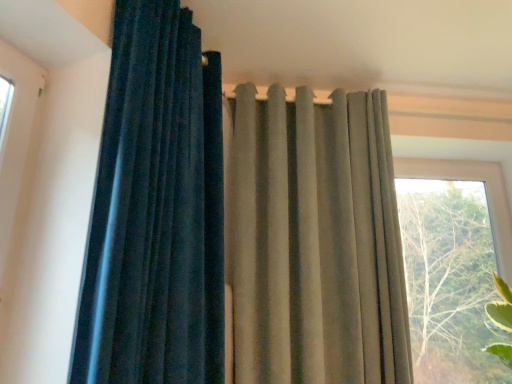
Question: Does velvet dark blue curtain at left, positioned as the second curtain in right-to-left order, appear on the left side of satin beige curtain at upper center, which is the second curtain from left to right?

Choices:
 (A) yes
 (B) no

Answer: (A)

Question: From a real-world perspective, is velvet dark blue curtain at left, acting as the first curtain starting from the left, physically below satin beige curtain at upper center, which is the second curtain from left to right?

Choices:
 (A) no
 (B) yes

Answer: (A)

Question: Is velvet dark blue curtain at left, positioned as the second curtain in right-to-left order, shorter than satin beige curtain at upper center, which is the 1th curtain in right-to-left order?

Choices:
 (A) yes
 (B) no

Answer: (A)

Question: Are velvet dark blue curtain at left, positioned as the second curtain in right-to-left order, and satin beige curtain at upper center, which is the second curtain from left to right, making contact?

Choices:
 (A) no
 (B) yes

Answer: (A)

Question: Is satin beige curtain at upper center, which is the second curtain from left to right, surrounded by velvet dark blue curtain at left, acting as the first curtain starting from the left?

Choices:
 (A) no
 (B) yes

Answer: (A)

Question: From the image's perspective, is velvet dark blue curtain at left, acting as the first curtain starting from the left, on top of satin beige curtain at upper center, which is the second curtain from left to right?

Choices:
 (A) yes
 (B) no

Answer: (A)

Question: From a real-world perspective, is satin beige curtain at upper center, which is the second curtain from left to right, over velvet dark blue curtain at left, positioned as the second curtain in right-to-left order?

Choices:
 (A) no
 (B) yes

Answer: (A)

Question: Can you confirm if satin beige curtain at upper center, which is the 1th curtain in right-to-left order, is positioned to the right of velvet dark blue curtain at left, acting as the first curtain starting from the left?

Choices:
 (A) yes
 (B) no

Answer: (A)

Question: Is velvet dark blue curtain at left, acting as the first curtain starting from the left, inside satin beige curtain at upper center, which is the second curtain from left to right?

Choices:
 (A) no
 (B) yes

Answer: (A)

Question: Is satin beige curtain at upper center, which is the second curtain from left to right, touching velvet dark blue curtain at left, acting as the first curtain starting from the left?

Choices:
 (A) no
 (B) yes

Answer: (A)

Question: From a real-world perspective, is satin beige curtain at upper center, which is the 1th curtain in right-to-left order, positioned under velvet dark blue curtain at left, acting as the first curtain starting from the left, based on gravity?

Choices:
 (A) yes
 (B) no

Answer: (A)

Question: Is satin beige curtain at upper center, which is the 1th curtain in right-to-left order, shorter than velvet dark blue curtain at left, acting as the first curtain starting from the left?

Choices:
 (A) no
 (B) yes

Answer: (A)

Question: Can you confirm if transparent glass window at right is shorter than velvet dark blue curtain at left, positioned as the second curtain in right-to-left order?

Choices:
 (A) yes
 (B) no

Answer: (A)